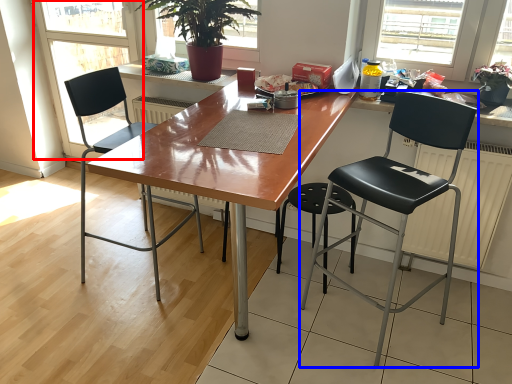
Question: Which object is further to the camera taking this photo, screen door (highlighted by a red box) or chair (highlighted by a blue box)?

Choices:
 (A) screen door
 (B) chair

Answer: (A)